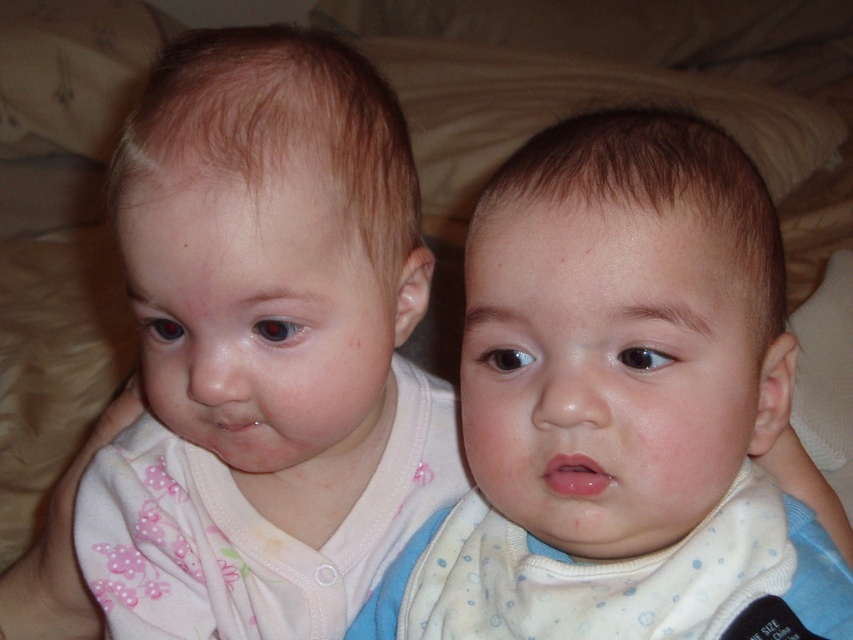
You are a photographer trying to capture a closeup of the white soft bib at center and the pink fabric face at left. Since the camera can only focus on one object at a time, which object should you focus on to ensure it fills more of the frame?

The white soft bib at center should be focused on because it has a larger size compared to the pink fabric face at left, so it will fill more of the frame.

You are a photographer trying to capture a closeup shot of the pink fabric face at left and the white soft bib at center. Your camera has a maximum focus range of 5 inches. Can you focus on both objects simultaneously?

The white soft bib at center and pink fabric face at left are 5.38 inches apart. Since the distance between them exceeds the camera maximum focus range of 5 inches, you cannot focus on both objects simultaneously.

Based on the scene description, where is the smooth skin baby at center located in terms of coordinates?

The smooth skin baby at center is located at coordinates point (x=608, y=371).